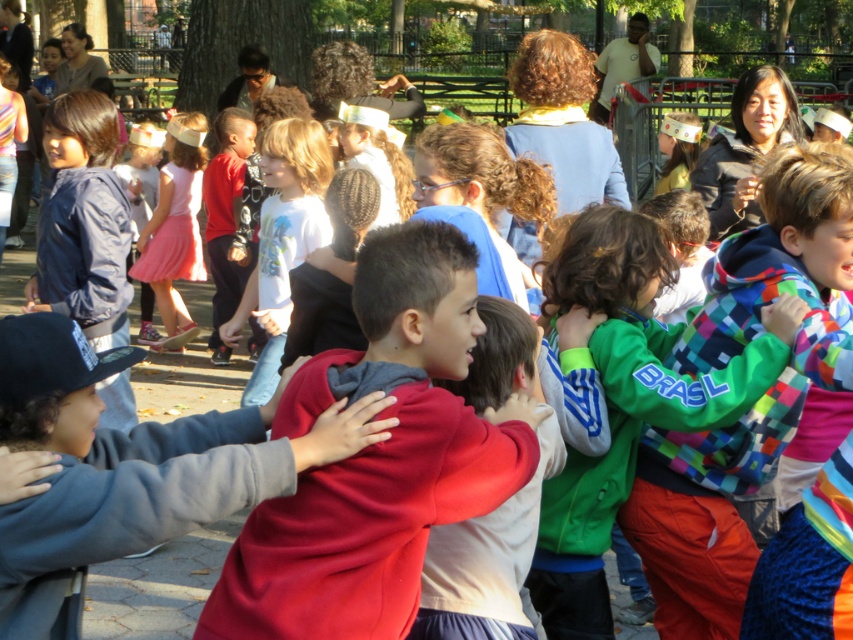
Which of these two, green fleece jacket at center or pink satin dress at center, stands taller?

Standing taller between the two is pink satin dress at center.

The width and height of the screenshot is (853, 640). I want to click on green fleece jacket at center, so click(x=621, y=404).

Can you confirm if red fleece jacket at center is thinner than white matte shirt at center?

Yes, red fleece jacket at center is thinner than white matte shirt at center.

Which is in front, point (552, 449) or point (303, 252)?

Point (552, 449) is in front.

Where is `red fleece jacket at center`? red fleece jacket at center is located at coordinates (485, 561).

Can you confirm if white matte shirt at center is thinner than pink satin dress at center?

In fact, white matte shirt at center might be wider than pink satin dress at center.

Does white matte shirt at center appear on the left side of pink satin dress at center?

In fact, white matte shirt at center is to the right of pink satin dress at center.

Find the location of a particular element. This screenshot has height=640, width=853. white matte shirt at center is located at coordinates (282, 241).